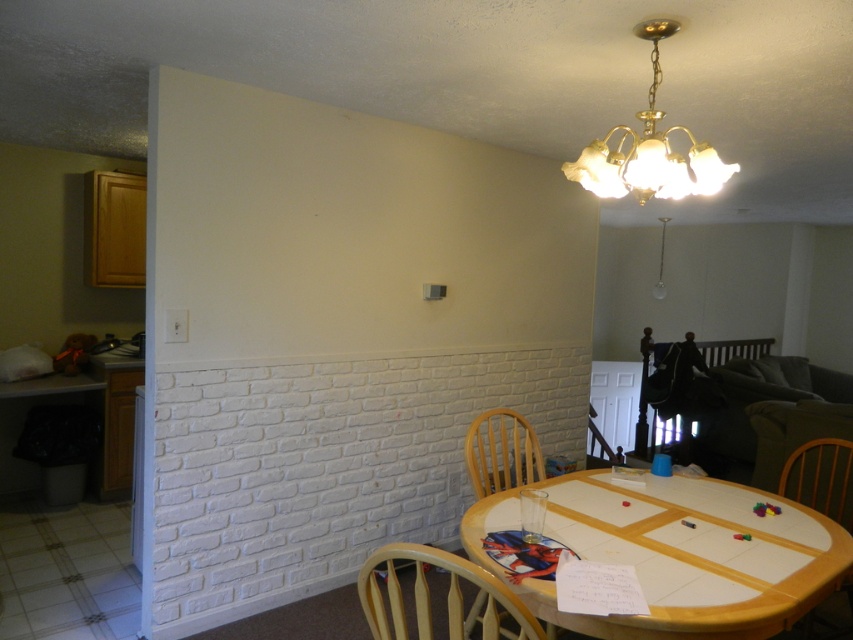
You are sitting in the light wood chair at lower center and want to reach the gold glass chandelier at upper center to clean it. Considering the chair is 45 cm tall, can you safely stand on it to reach the chandelier?

The light wood chair at lower center is positioned under the gold glass chandelier at upper center. Since the chair is only 45 cm tall, standing on it may not provide sufficient height to safely reach the chandelier. A taller stool or ladder would be safer for this task.

You are hosting a dinner party and need to seat guests around the wooden table at lower center. Considering the size of the wooden chair at lower right, will there be enough space for 4 chairs around the table?

The wooden table at lower center is bigger than the wooden chair at lower right, so there should be enough space to seat 4 chairs around it.